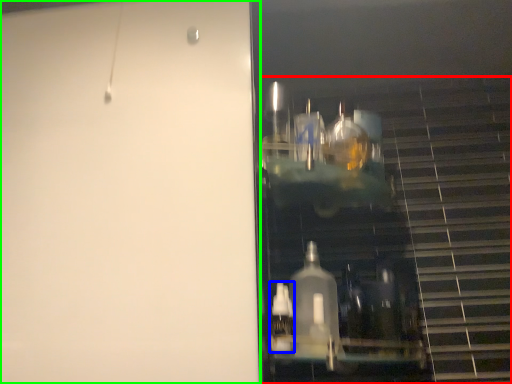
Question: Which object is the closest to the stairwell (highlighted by a red box)? Choose among these: bottle (highlighted by a blue box) or door (highlighted by a green box).

Choices:
 (A) bottle
 (B) door

Answer: (A)